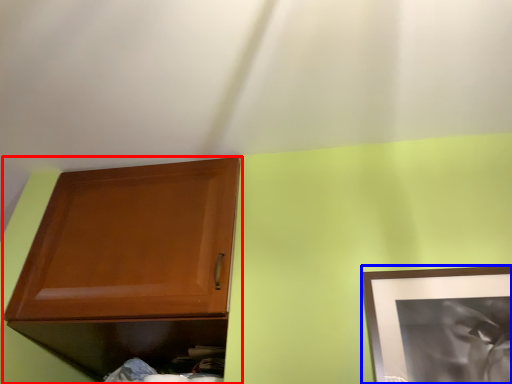
Question: Which object is closer to the camera taking this photo, cabinetry (highlighted by a red box) or picture frame (highlighted by a blue box)?

Choices:
 (A) cabinetry
 (B) picture frame

Answer: (B)